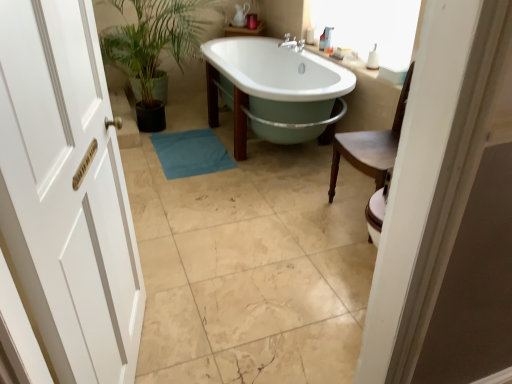
Measure the distance between point (331, 57) and camera.

Point (331, 57) and camera are 3.21 meters apart from each other.

Find the location of `white glossy sink at upper right`. white glossy sink at upper right is located at coordinates [x=361, y=66].

The image size is (512, 384). In order to click on pastel green enamel bathtub at center in this screenshot , I will do [x=280, y=85].

This screenshot has width=512, height=384. What do you see at coordinates (67, 192) in the screenshot? I see `white wooden door at left` at bounding box center [67, 192].

This screenshot has height=384, width=512. What are the coordinates of `white glossy sink at upper right` in the screenshot? It's located at (361, 66).

Would you say pastel green enamel bathtub at center is a long distance from white glossy sink at upper right?

No, pastel green enamel bathtub at center is in close proximity to white glossy sink at upper right.

Identify the location of bathtub below the white glossy sink at upper right (from the image's perspective). (280, 85).

Considering the sizes of objects pastel green enamel bathtub at center and white glossy sink at upper right in the image provided, who is wider, pastel green enamel bathtub at center or white glossy sink at upper right?

Wider between the two is pastel green enamel bathtub at center.

What's the angular difference between pastel green enamel bathtub at center and white glossy sink at upper right's facing directions?

They differ by 1.37 degrees in their facing directions.

Considering the positions of objects teal fabric bath mat at center and pastel green enamel bathtub at center in the image provided, who is more to the right, teal fabric bath mat at center or pastel green enamel bathtub at center?

From the viewer's perspective, pastel green enamel bathtub at center appears more on the right side.

Does point (163, 144) lie in front of point (354, 85)?

No, (163, 144) is further to viewer.

Is teal fabric bath mat at center thinner than pastel green enamel bathtub at center?

Yes.

Can you tell me how much teal fabric bath mat at center and pastel green enamel bathtub at center differ in facing direction?

teal fabric bath mat at center and pastel green enamel bathtub at center are facing 3.5 degrees away from each other.

Is white wooden door at left not close to white glossy sink at upper right?

white wooden door at left is far away from white glossy sink at upper right.

Identify the location of counter top that is on the right side of white wooden door at left. (361, 66).

Is white wooden door at left not close to pastel green enamel bathtub at center?

Yes, white wooden door at left and pastel green enamel bathtub at center are quite far apart.

How many degrees apart are the facing directions of white wooden door at left and pastel green enamel bathtub at center?

white wooden door at left and pastel green enamel bathtub at center are facing 162 degrees away from each other.

Between white wooden door at left and pastel green enamel bathtub at center, which one has larger width?

pastel green enamel bathtub at center is wider.

Which object is further away from the camera, white wooden door at left or pastel green enamel bathtub at center?

pastel green enamel bathtub at center is further from the camera.

From a real-world perspective, is white glossy sink at upper right physically above white wooden door at left?

Incorrect, from a real-world perspective, white glossy sink at upper right is lower than white wooden door at left.

Is white glossy sink at upper right not within white wooden door at left?

Yes.

Is white glossy sink at upper right shorter than white wooden door at left?

Correct, white glossy sink at upper right is not as tall as white wooden door at left.

Where is `bath mat above the white wooden door at left (from the image's perspective)`? Image resolution: width=512 pixels, height=384 pixels. bath mat above the white wooden door at left (from the image's perspective) is located at coordinates (191, 153).

Is teal fabric bath mat at center facing towards white wooden door at left?

No, teal fabric bath mat at center is not oriented towards white wooden door at left.

In the scene shown: Considering their positions, is teal fabric bath mat at center located in front of or behind white wooden door at left?

Clearly, teal fabric bath mat at center is behind white wooden door at left.

The height and width of the screenshot is (384, 512). In order to click on bath mat on the left of white wooden door at left in this screenshot , I will do coord(191,153).

Considering the sizes of objects white wooden door at left and teal fabric bath mat at center in the image provided, who is smaller, white wooden door at left or teal fabric bath mat at center?

Smaller between the two is teal fabric bath mat at center.

From a real-world perspective, who is located higher, white wooden door at left or teal fabric bath mat at center?

white wooden door at left, from a real-world perspective.

From the image's perspective, which one is positioned lower, white wooden door at left or teal fabric bath mat at center?

white wooden door at left, from the image's perspective.

Where is `bathtub located in front of the white glossy sink at upper right`? The width and height of the screenshot is (512, 384). bathtub located in front of the white glossy sink at upper right is located at coordinates (280, 85).

Locate an element on the screen. bath mat below the pastel green enamel bathtub at center (from the image's perspective) is located at coordinates (191, 153).

Estimate the real-world distances between objects in this image. Which object is closer to white wooden door at left, pastel green enamel bathtub at center or teal fabric bath mat at center?

teal fabric bath mat at center lies closer to white wooden door at left than the other object.

Which object lies nearer to the anchor point pastel green enamel bathtub at center, white wooden door at left or teal fabric bath mat at center?

Among the two, teal fabric bath mat at center is located nearer to pastel green enamel bathtub at center.

Based on their spatial positions, is teal fabric bath mat at center or white glossy sink at upper right further from pastel green enamel bathtub at center?

teal fabric bath mat at center is positioned further to the anchor pastel green enamel bathtub at center.

When comparing their distances from pastel green enamel bathtub at center, does teal fabric bath mat at center or white wooden door at left seem closer?

teal fabric bath mat at center is closer to pastel green enamel bathtub at center.

Estimate the real-world distances between objects in this image. Which object is closer to white wooden door at left, white glossy sink at upper right or pastel green enamel bathtub at center?

pastel green enamel bathtub at center is closer to white wooden door at left.

From the picture: Which object lies further to the anchor point white glossy sink at upper right, pastel green enamel bathtub at center or teal fabric bath mat at center?

teal fabric bath mat at center.

Looking at the image, which one is located further to white wooden door at left, pastel green enamel bathtub at center or white glossy sink at upper right?

white glossy sink at upper right.

Estimate the real-world distances between objects in this image. Which object is further from teal fabric bath mat at center, white wooden door at left or white glossy sink at upper right?

white wooden door at left is further to teal fabric bath mat at center.

Image resolution: width=512 pixels, height=384 pixels. I want to click on bathtub between white wooden door at left and teal fabric bath mat at center along the z-axis, so [280, 85].

Image resolution: width=512 pixels, height=384 pixels. I want to click on bathtub located between teal fabric bath mat at center and white glossy sink at upper right in the left-right direction, so click(280, 85).

The width and height of the screenshot is (512, 384). Identify the location of bathtub positioned between white wooden door at left and white glossy sink at upper right from near to far. (280, 85).

Identify the location of counter top between white wooden door at left and teal fabric bath mat at center from front to back. (361, 66).